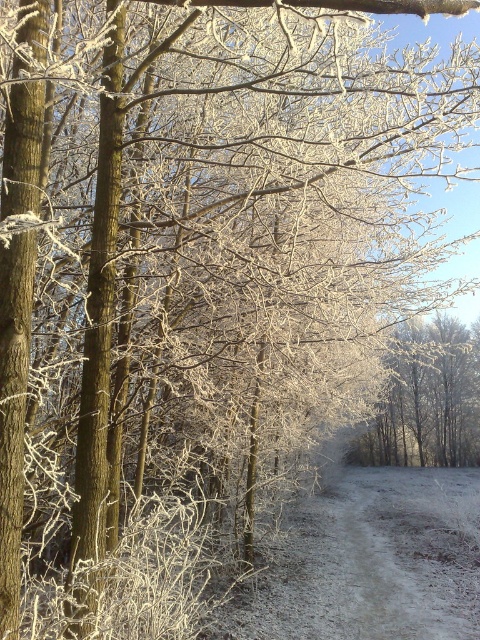
Question: Among these objects, which one is farthest from the camera?

Choices:
 (A) frosted dirt path at center
 (B) frosted branches at center

Answer: (B)

Question: Does frosted dirt path at center appear under frosted branches at center?

Choices:
 (A) no
 (B) yes

Answer: (B)

Question: Can you confirm if frosted dirt path at center is positioned below frosted branches at center?

Choices:
 (A) no
 (B) yes

Answer: (B)

Question: Which point is closer to the camera taking this photo?

Choices:
 (A) (456, 403)
 (B) (286, 560)

Answer: (B)

Question: Is frosted dirt path at center closer to the viewer compared to frosted branches at center?

Choices:
 (A) no
 (B) yes

Answer: (B)